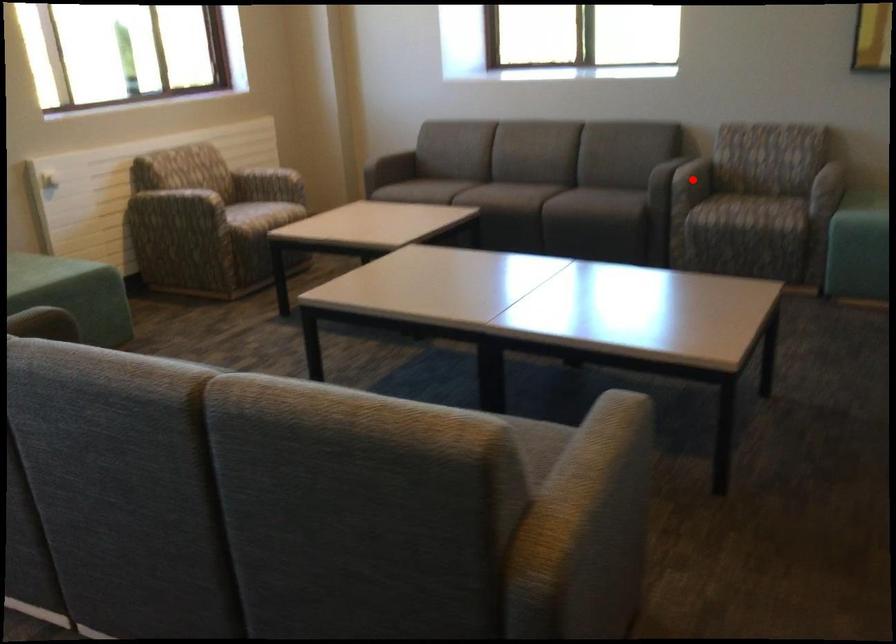
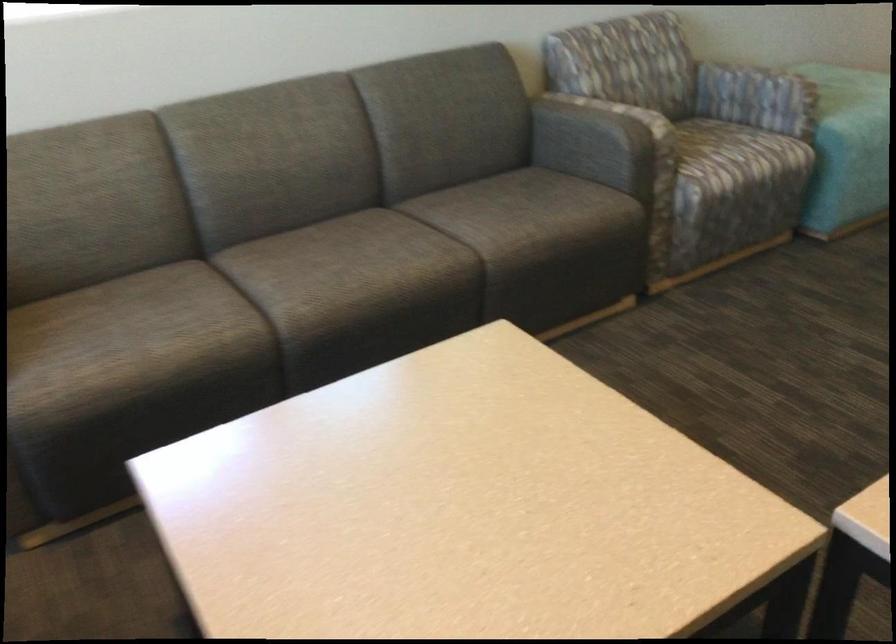
Question: I am providing you with two images of the same scene from different viewpoints. A red point is marked on the first image. Can you still see the location of the red point in image 2?

Choices:
 (A) Yes
 (B) No

Answer: (B)